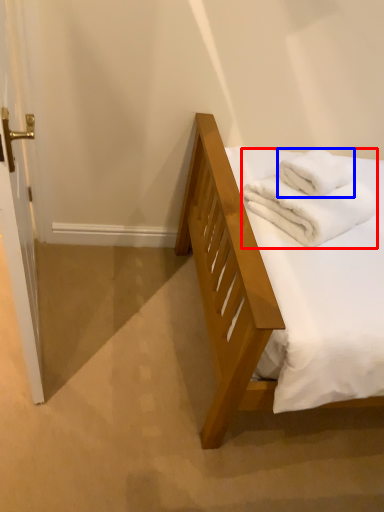
Question: Which of the following is the closest to the observer, bath towel (highlighted by a red box) or bath towel (highlighted by a blue box)?

Choices:
 (A) bath towel
 (B) bath towel

Answer: (A)